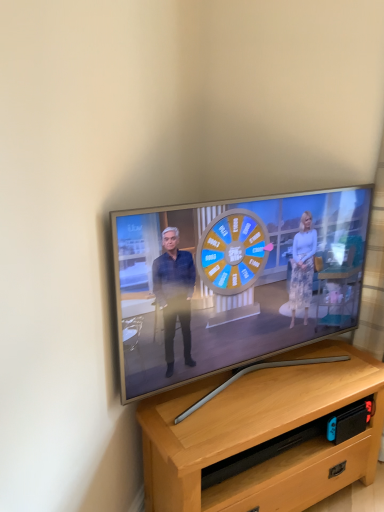
Question: Do you think matte silver tv at center is within light brown wood desk at center, or outside of it?

Choices:
 (A) inside
 (B) outside

Answer: (B)

Question: In terms of height, does matte silver tv at center look taller or shorter compared to light brown wood desk at center?

Choices:
 (A) short
 (B) tall

Answer: (B)

Question: Considering the relative positions of matte silver tv at center and light brown wood desk at center in the image provided, is matte silver tv at center to the left or to the right of light brown wood desk at center?

Choices:
 (A) right
 (B) left

Answer: (B)

Question: Is light brown wood desk at center spatially inside matte silver tv at center, or outside of it?

Choices:
 (A) inside
 (B) outside

Answer: (B)

Question: From a real-world perspective, is light brown wood desk at center physically located above or below matte silver tv at center?

Choices:
 (A) below
 (B) above

Answer: (A)

Question: Is point (286, 454) closer or farther from the camera than point (137, 301)?

Choices:
 (A) closer
 (B) farther

Answer: (B)

Question: Is light brown wood desk at center taller or shorter than matte silver tv at center?

Choices:
 (A) tall
 (B) short

Answer: (B)